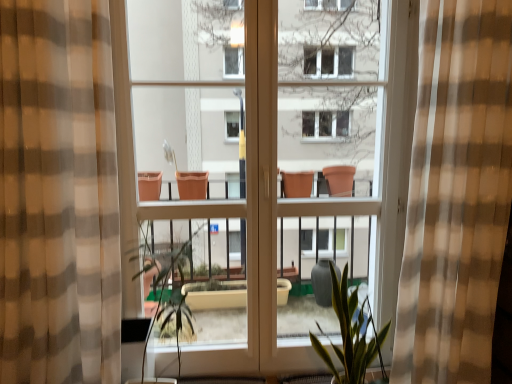
At what (x,y) coordinates should I click in order to perform the action: click on green matte plant at center. Please return your answer as a coordinate pair (x, y). The width and height of the screenshot is (512, 384). Looking at the image, I should click on tap(351, 335).

The image size is (512, 384). What are the coordinates of `green leafy plant at center` in the screenshot? It's located at (167, 294).

What is the approximate width of green leafy plant at center?

It is 49.96 centimeters.

Locate an element on the screen. The width and height of the screenshot is (512, 384). checkered fabric curtain at center, which is the 2th curtain from left to right is located at coordinates (456, 194).

At what (x,y) coordinates should I click in order to perform the action: click on green matte plant at center. Please return your answer as a coordinate pair (x, y). The height and width of the screenshot is (384, 512). Looking at the image, I should click on (351, 335).

Is checkered fabric curtain at center, which is the 2th curtain from left to right, inside or outside of green matte plant at center?

checkered fabric curtain at center, which is the 2th curtain from left to right, is not inside green matte plant at center, it's outside.

Which of these two, checkered fabric curtain at center, which is the 2th curtain from left to right, or green matte plant at center, is wider?

With larger width is checkered fabric curtain at center, which is the 2th curtain from left to right.

From a real-world perspective, is checkered fabric curtain at center, which is the 2th curtain from left to right, positioned above or below green matte plant at center?

In terms of real-world spatial position, checkered fabric curtain at center, which is the 2th curtain from left to right, is above green matte plant at center.

Between checkered fabric curtain at center, which is the 1th curtain in right-to-left order, and green matte plant at center, which one has less height?

green matte plant at center is shorter.

From the image's perspective, is brown checkered curtain at left, the 1th curtain when ordered from left to right, on green leafy plant at center?

Indeed, from the image's perspective, brown checkered curtain at left, the 1th curtain when ordered from left to right, is shown above green leafy plant at center.

Considering the relative positions of brown checkered curtain at left, the 1th curtain when ordered from left to right, and green leafy plant at center in the image provided, is brown checkered curtain at left, the 1th curtain when ordered from left to right, to the left or to the right of green leafy plant at center?

Based on their positions, brown checkered curtain at left, the 1th curtain when ordered from left to right, is located to the left of green leafy plant at center.

Considering their positions, is brown checkered curtain at left, arranged as the second curtain when viewed from the right, located in front of or behind green leafy plant at center?

Clearly, brown checkered curtain at left, arranged as the second curtain when viewed from the right, is in front of green leafy plant at center.

Consider the image. From a real-world perspective, which is physically below, green matte plant at center or green leafy plant at center?

green matte plant at center, from a real-world perspective.

Is green matte plant at center far from green leafy plant at center?

green matte plant at center is actually quite close to green leafy plant at center.

Which is behind, green matte plant at center or green leafy plant at center?

green matte plant at center.

Is checkered fabric curtain at center, which is the 1th curtain in right-to-left order, in front of or behind green leafy plant at center in the image?

Clearly, checkered fabric curtain at center, which is the 1th curtain in right-to-left order, is in front of green leafy plant at center.

Between checkered fabric curtain at center, which is the 2th curtain from left to right, and green leafy plant at center, which one appears on the left side from the viewer's perspective?

Positioned to the left is green leafy plant at center.

Consider the image. Is there a large distance between checkered fabric curtain at center, which is the 2th curtain from left to right, and green leafy plant at center?

checkered fabric curtain at center, which is the 2th curtain from left to right, is positioned a significant distance from green leafy plant at center.

Is checkered fabric curtain at center, which is the 1th curtain in right-to-left order, not within green leafy plant at center?

Indeed, checkered fabric curtain at center, which is the 1th curtain in right-to-left order, is completely outside green leafy plant at center.

Considering the relative positions of green leafy plant at center and checkered fabric curtain at center, which is the 2th curtain from left to right, in the image provided, is green leafy plant at center to the left or to the right of checkered fabric curtain at center, which is the 2th curtain from left to right,?

green leafy plant at center is positioned on checkered fabric curtain at center, which is the 2th curtain from left to right,'s left side.

Is green leafy plant at center looking in the opposite direction of checkered fabric curtain at center, which is the 1th curtain in right-to-left order?

No, green leafy plant at center is not facing away from checkered fabric curtain at center, which is the 1th curtain in right-to-left order.

Which of these two, green leafy plant at center or checkered fabric curtain at center, which is the 2th curtain from left to right, stands shorter?

With less height is green leafy plant at center.

Considering the sizes of objects green leafy plant at center and checkered fabric curtain at center, which is the 2th curtain from left to right, in the image provided, who is wider, green leafy plant at center or checkered fabric curtain at center, which is the 2th curtain from left to right,?

With larger width is green leafy plant at center.

From a real-world perspective, does brown checkered curtain at left, the 1th curtain when ordered from left to right, stand above checkered fabric curtain at center, which is the 1th curtain in right-to-left order?

Indeed, from a real-world perspective, brown checkered curtain at left, the 1th curtain when ordered from left to right, stands above checkered fabric curtain at center, which is the 1th curtain in right-to-left order.

Does brown checkered curtain at left, arranged as the second curtain when viewed from the right, touch checkered fabric curtain at center, which is the 2th curtain from left to right?

There is a gap between brown checkered curtain at left, arranged as the second curtain when viewed from the right, and checkered fabric curtain at center, which is the 2th curtain from left to right.

Find the location of a particular element. This screenshot has width=512, height=384. curtain that appears on the left of checkered fabric curtain at center, which is the 2th curtain from left to right is located at coordinates (58, 195).

How far apart are brown checkered curtain at left, arranged as the second curtain when viewed from the right, and checkered fabric curtain at center, which is the 1th curtain in right-to-left order?

The distance of brown checkered curtain at left, arranged as the second curtain when viewed from the right, from checkered fabric curtain at center, which is the 1th curtain in right-to-left order, is 3.83 feet.

Based on the photo, are green matte plant at center and brown checkered curtain at left, the 1th curtain when ordered from left to right, far apart?

green matte plant at center is positioned a significant distance from brown checkered curtain at left, the 1th curtain when ordered from left to right.

In the scene shown: From a real-world perspective, is green matte plant at center physically located above or below brown checkered curtain at left, the 1th curtain when ordered from left to right?

From a real-world perspective, green matte plant at center is physically below brown checkered curtain at left, the 1th curtain when ordered from left to right.

Which object is thinner, green matte plant at center or brown checkered curtain at left, arranged as the second curtain when viewed from the right?

green matte plant at center.

Find the location of a particular element. The image size is (512, 384). houseplant that is under the checkered fabric curtain at center, which is the 2th curtain from left to right (from a real-world perspective) is located at coordinates (351, 335).

Identify the location of vegetation behind the brown checkered curtain at left, the 1th curtain when ordered from left to right. The height and width of the screenshot is (384, 512). (167, 294).

Looking at the image, which one is located further to checkered fabric curtain at center, which is the 2th curtain from left to right, brown checkered curtain at left, the 1th curtain when ordered from left to right, or green matte plant at center?

The object further to checkered fabric curtain at center, which is the 2th curtain from left to right, is brown checkered curtain at left, the 1th curtain when ordered from left to right.

Based on their spatial positions, is green matte plant at center or checkered fabric curtain at center, which is the 2th curtain from left to right, closer to brown checkered curtain at left, the 1th curtain when ordered from left to right?

Based on the image, green matte plant at center appears to be nearer to brown checkered curtain at left, the 1th curtain when ordered from left to right.

Based on their spatial positions, is checkered fabric curtain at center, which is the 1th curtain in right-to-left order, or green leafy plant at center further from brown checkered curtain at left, arranged as the second curtain when viewed from the right?

checkered fabric curtain at center, which is the 1th curtain in right-to-left order, is further to brown checkered curtain at left, arranged as the second curtain when viewed from the right.

When comparing their distances from brown checkered curtain at left, arranged as the second curtain when viewed from the right, does green matte plant at center or green leafy plant at center seem further?

Among the two, green matte plant at center is located further to brown checkered curtain at left, arranged as the second curtain when viewed from the right.

Estimate the real-world distances between objects in this image. Which object is closer to green matte plant at center, green leafy plant at center or brown checkered curtain at left, arranged as the second curtain when viewed from the right?

green leafy plant at center lies closer to green matte plant at center than the other object.

From the image, which object appears to be nearer to brown checkered curtain at left, the 1th curtain when ordered from left to right, green leafy plant at center or green matte plant at center?

Based on the image, green leafy plant at center appears to be nearer to brown checkered curtain at left, the 1th curtain when ordered from left to right.

In the scene shown: From the image, which object appears to be farther from checkered fabric curtain at center, which is the 2th curtain from left to right, green matte plant at center or green leafy plant at center?

green leafy plant at center is positioned further to the anchor checkered fabric curtain at center, which is the 2th curtain from left to right.

Estimate the real-world distances between objects in this image. Which object is further from green matte plant at center, checkered fabric curtain at center, which is the 2th curtain from left to right, or brown checkered curtain at left, arranged as the second curtain when viewed from the right?

brown checkered curtain at left, arranged as the second curtain when viewed from the right, is further to green matte plant at center.

I want to click on houseplant between green leafy plant at center and checkered fabric curtain at center, which is the 2th curtain from left to right, from left to right, so click(x=351, y=335).

Image resolution: width=512 pixels, height=384 pixels. Identify the location of vegetation located between brown checkered curtain at left, the 1th curtain when ordered from left to right, and green matte plant at center in the left-right direction. point(167,294).

You are a GUI agent. You are given a task and a screenshot of the screen. Output one action in this format:
    pyautogui.click(x=<x>, y=<y>)
    Task: Click on the vegetation located between brown checkered curtain at left, arranged as the second curtain when viewed from the right, and checkered fabric curtain at center, which is the 1th curtain in right-to-left order, in the left-right direction
    The height and width of the screenshot is (384, 512).
    Given the screenshot: What is the action you would take?
    pyautogui.click(x=167, y=294)

Where is `houseplant located between brown checkered curtain at left, arranged as the second curtain when viewed from the right, and checkered fabric curtain at center, which is the 1th curtain in right-to-left order, in the left-right direction`? houseplant located between brown checkered curtain at left, arranged as the second curtain when viewed from the right, and checkered fabric curtain at center, which is the 1th curtain in right-to-left order, in the left-right direction is located at coordinates (351, 335).